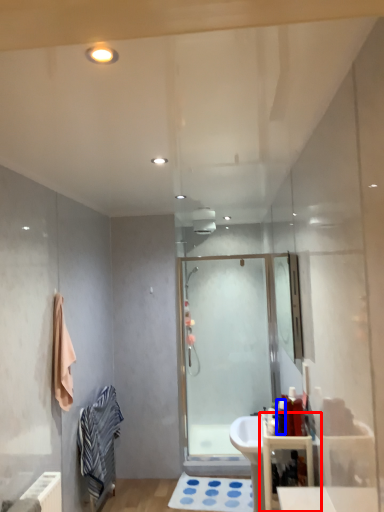
Question: Among these objects, which one is nearest to the camera, bathroom cabinet (highlighted by a red box) or toiletry (highlighted by a blue box)?

Choices:
 (A) bathroom cabinet
 (B) toiletry

Answer: (A)